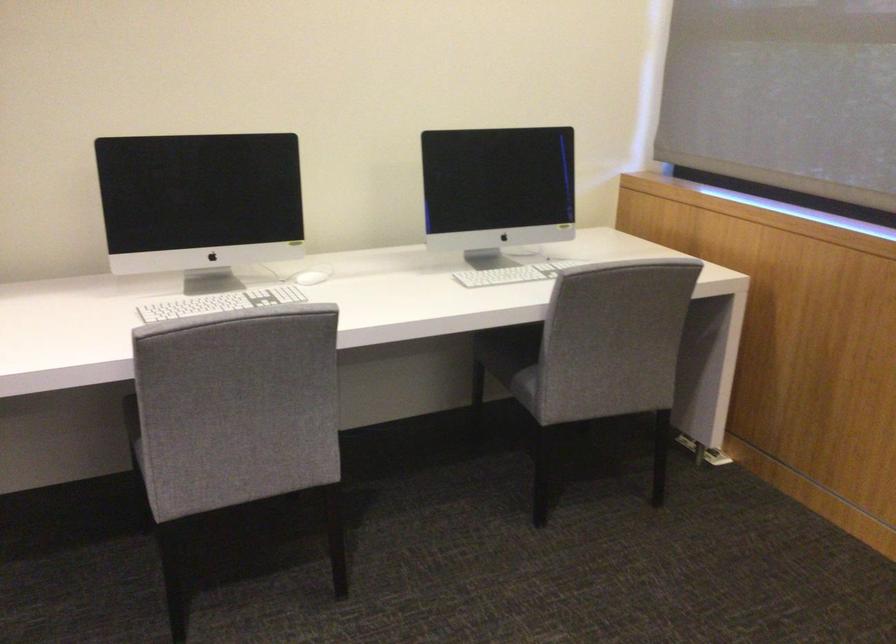
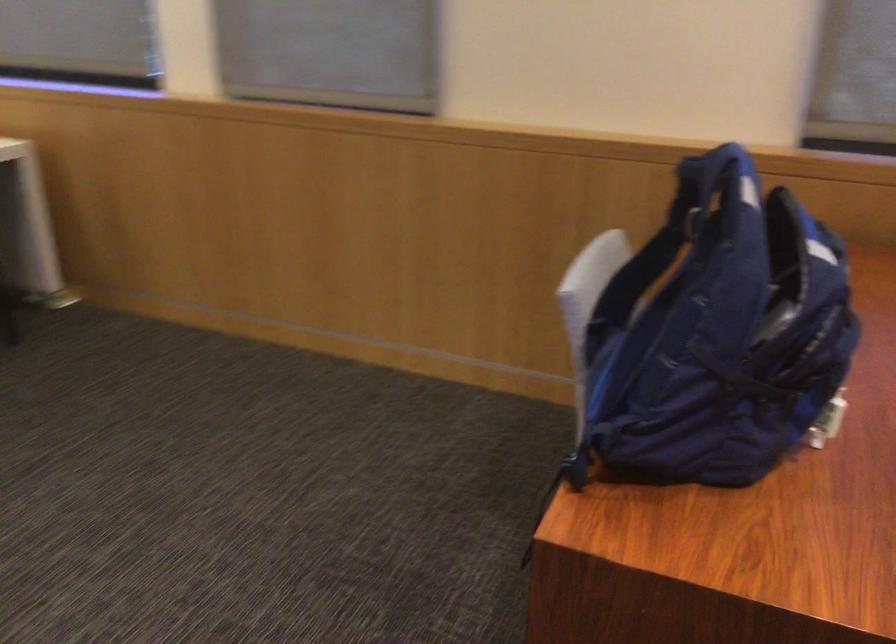
Question: Based on the continuous images, in which direction is the camera rotating? Reply with the corresponding letter.

Choices:
 (A) Left
 (B) Right
 (C) Up
 (D) Down

Answer: (B)